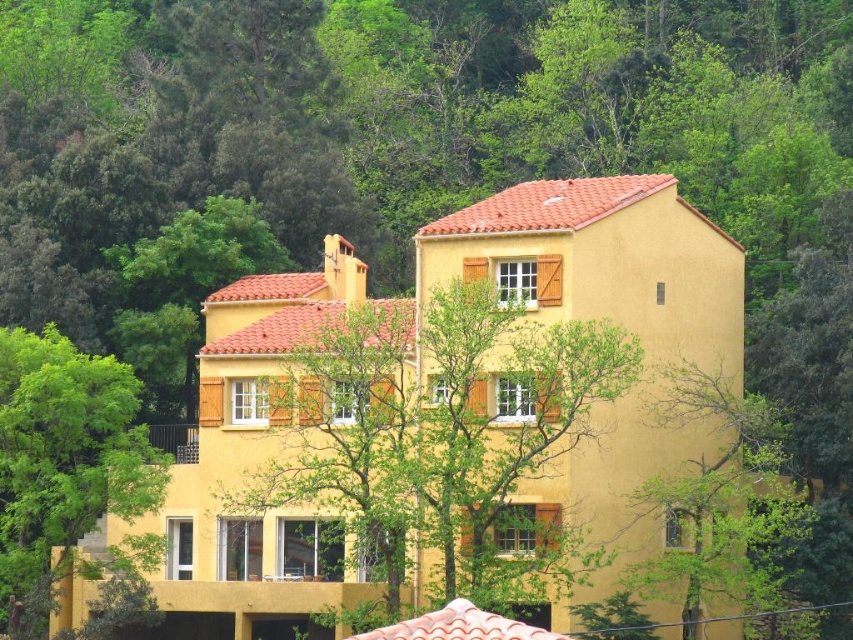
From the picture: Does green leafy tree at center have a smaller size compared to green leafy tree at lower left?

Actually, green leafy tree at center might be larger than green leafy tree at lower left.

Is green leafy tree at center positioned before green leafy tree at lower left?

Yes.

This screenshot has width=853, height=640. Describe the element at coordinates (437, 435) in the screenshot. I see `green leafy tree at center` at that location.

Find the location of a particular element. The height and width of the screenshot is (640, 853). green leafy tree at center is located at coordinates (437, 435).